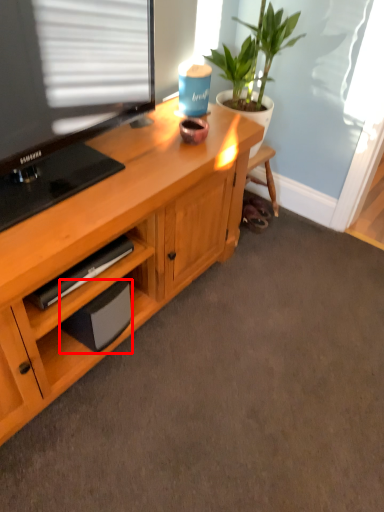
Question: From the image's perspective, what is the correct spatial relationship of speaker (annotated by the red box) in relation to houseplant?

Choices:
 (A) above
 (B) below

Answer: (B)